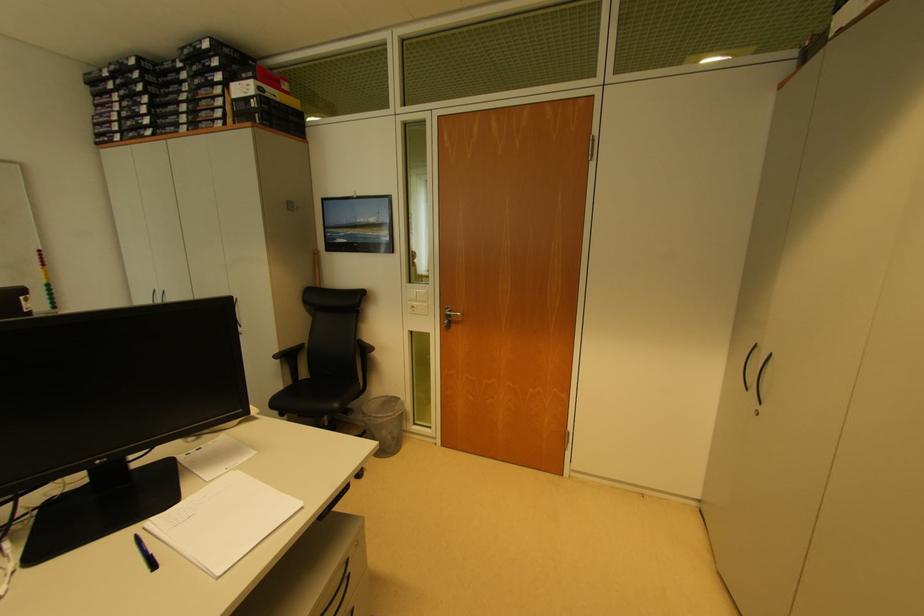
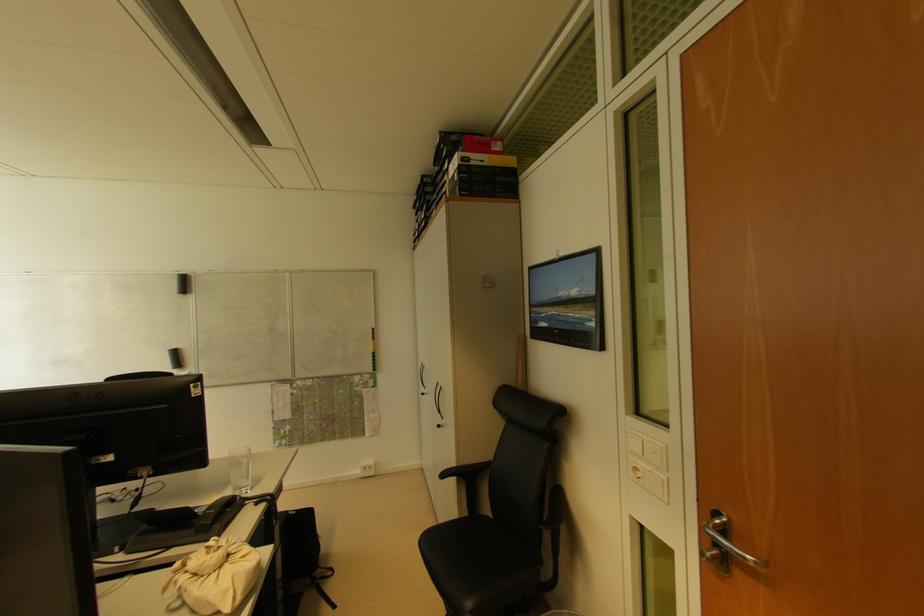
The point at [254,103] is marked in the first image. Where is the corresponding point in the second image?

(457, 177)